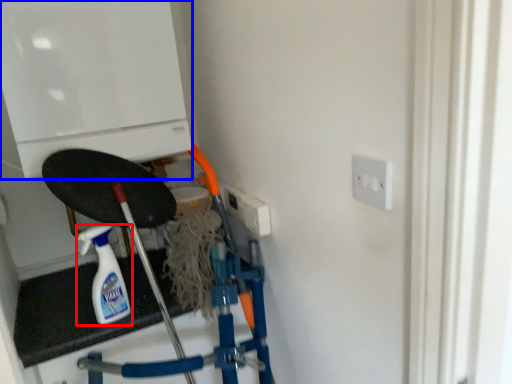
Question: Which object appears closest to the camera in this image, bottle (highlighted by a red box) or appliance (highlighted by a blue box)?

Choices:
 (A) bottle
 (B) appliance

Answer: (B)